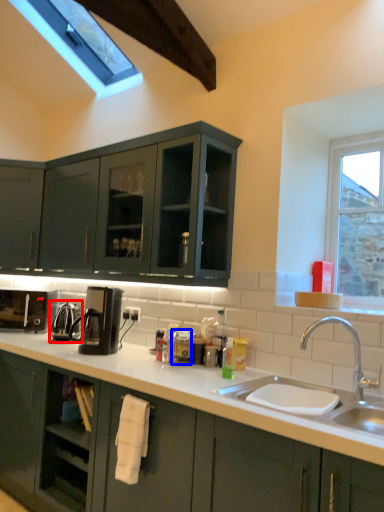
Question: Which point is closer to the camera, appliance (highlighted by a red box) or appliance (highlighted by a blue box)?

Choices:
 (A) appliance
 (B) appliance

Answer: (B)